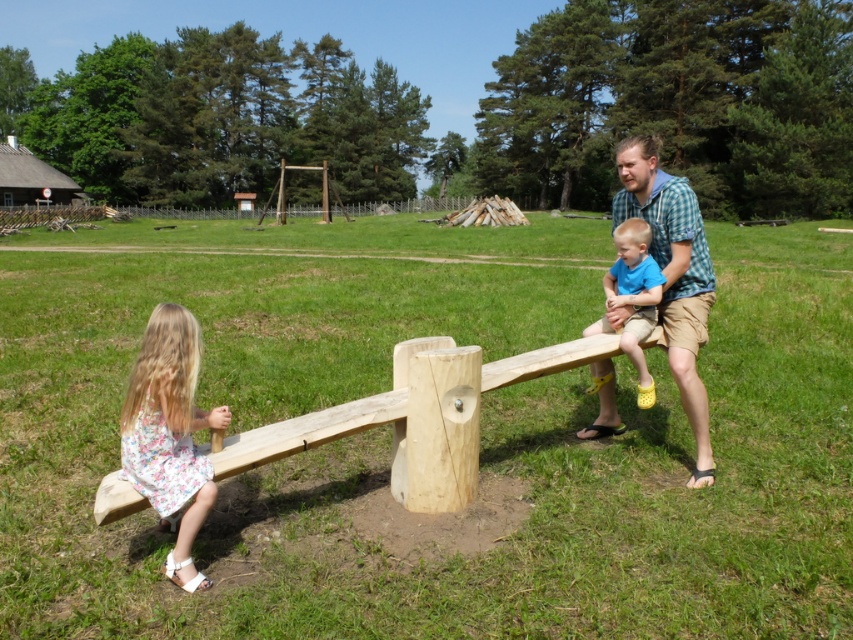
You are a photographer planning to take a photo of the floral fabric dress at left and the checkered fabric shirt at right in the scene. You want to ensure both are visible in the frame. Given their height differences, which clothing item should you focus on to include both in the photo?

The floral fabric dress at left is shorter than the checkered fabric shirt at right. To include both in the photo, focus on the checkered fabric shirt at right as it is taller, ensuring the dress at left will also be in frame.

You are designing a new playground and need to ensure that the seats on the seesaw are appropriately sized for children. Given the image, which of the two clothing items, the floral fabric dress at left or the blue cotton shirt at right, is narrower in width, and why?

The floral fabric dress at left is narrower in width than the blue cotton shirt at right, as stated in the description.